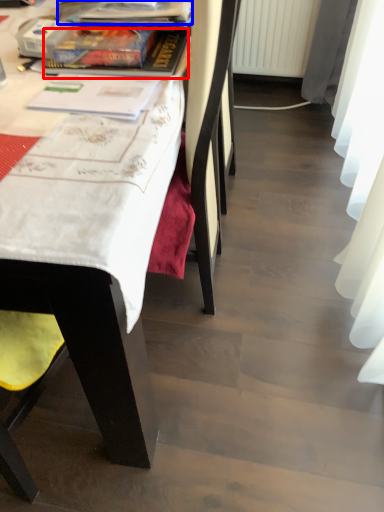
Question: Which point is further to the camera, book (highlighted by a red box) or book (highlighted by a blue box)?

Choices:
 (A) book
 (B) book

Answer: (B)